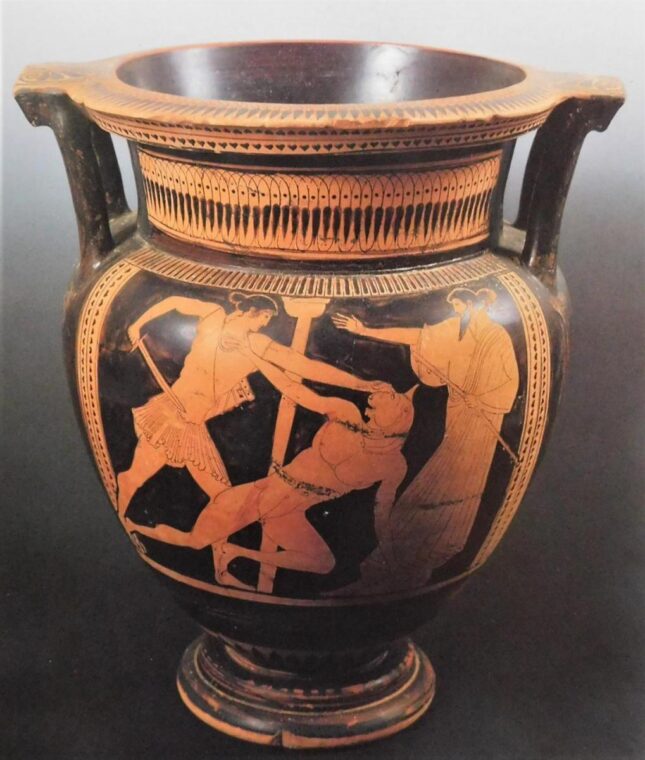
Find the location of a particular element. The image size is (645, 760). robe is located at coordinates (428, 346).